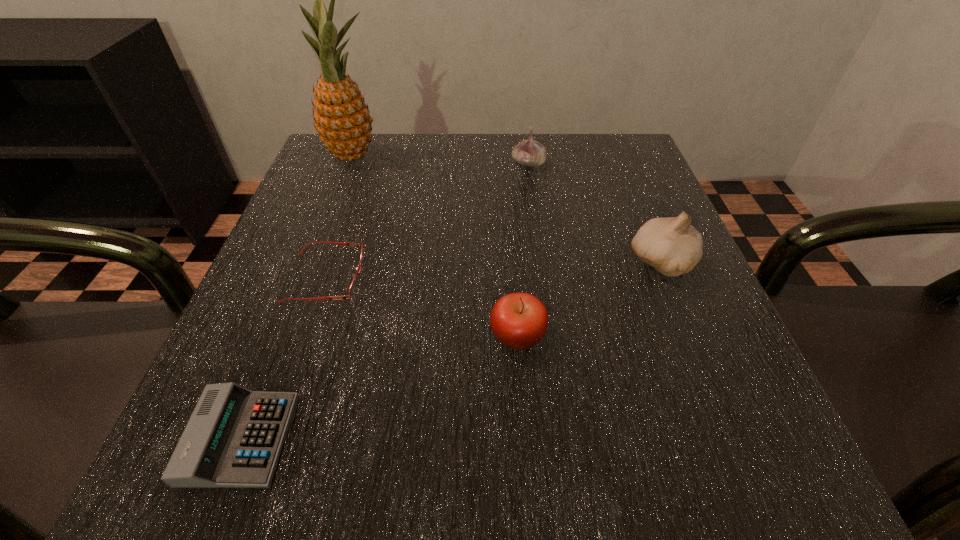
Where is `empty space between the nearest object and the pineapple`? The width and height of the screenshot is (960, 540). empty space between the nearest object and the pineapple is located at coordinates (297, 297).

I want to click on free space that is in between the apple and the tallest object, so click(435, 246).

You are a GUI agent. You are given a task and a screenshot of the screen. Output one action in this format:
    pyautogui.click(x=<x>, y=<y>)
    Task: Click on the free spot between the second nearest object and the left garlic
    This screenshot has height=540, width=960.
    Given the screenshot: What is the action you would take?
    pyautogui.click(x=523, y=250)

The image size is (960, 540). Identify the location of free area in between the nearest object and the apple. (379, 387).

The height and width of the screenshot is (540, 960). I want to click on unoccupied area between the left garlic and the second nearest object, so click(523, 250).

The height and width of the screenshot is (540, 960). I want to click on free space between the nearest object and the spectacles, so [x=283, y=358].

You are a GUI agent. You are given a task and a screenshot of the screen. Output one action in this format:
    pyautogui.click(x=<x>, y=<y>)
    Task: Click on the vacant area between the apple and the nearest object
    The image size is (960, 540).
    Given the screenshot: What is the action you would take?
    pyautogui.click(x=379, y=387)

Locate an element on the screen. Image resolution: width=960 pixels, height=540 pixels. unoccupied area between the spectacles and the farther garlic is located at coordinates (427, 221).

Image resolution: width=960 pixels, height=540 pixels. What are the coordinates of `unoccupied area between the left garlic and the fifth farthest object` in the screenshot? It's located at (523, 250).

The image size is (960, 540). Find the location of `vacant area that lies between the apple and the shorter garlic`. vacant area that lies between the apple and the shorter garlic is located at coordinates (523, 250).